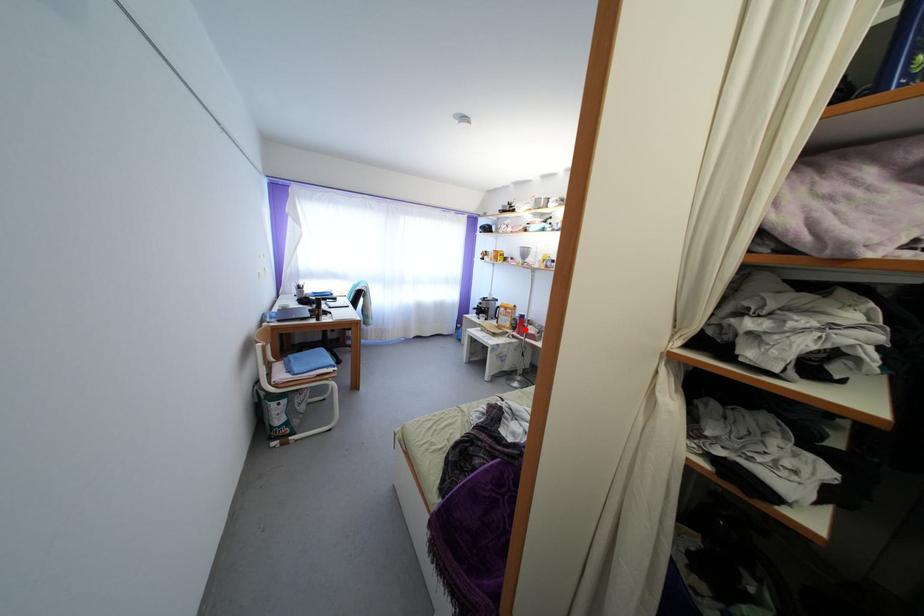
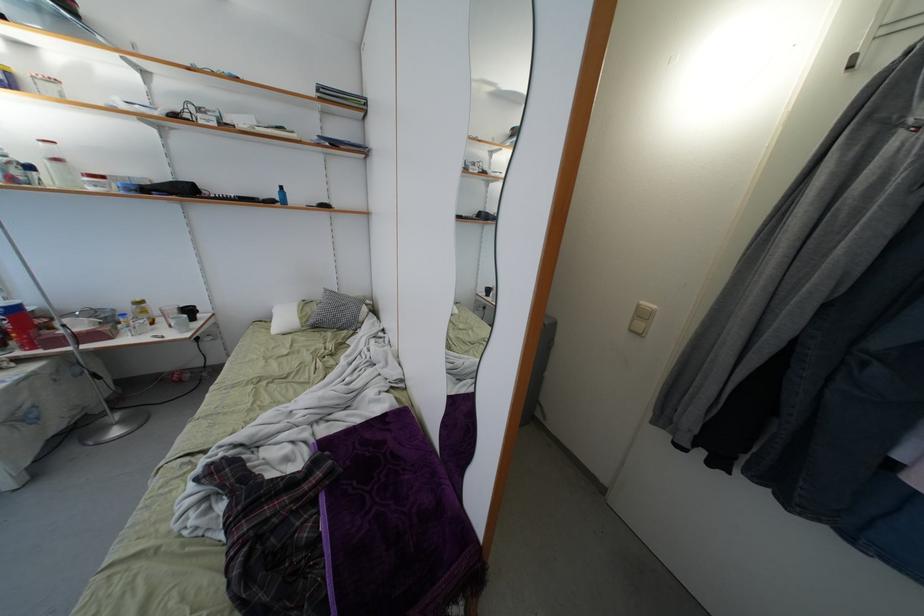
In the second image, find the point that corresponds to the highlighted location in the first image.

(22, 333)